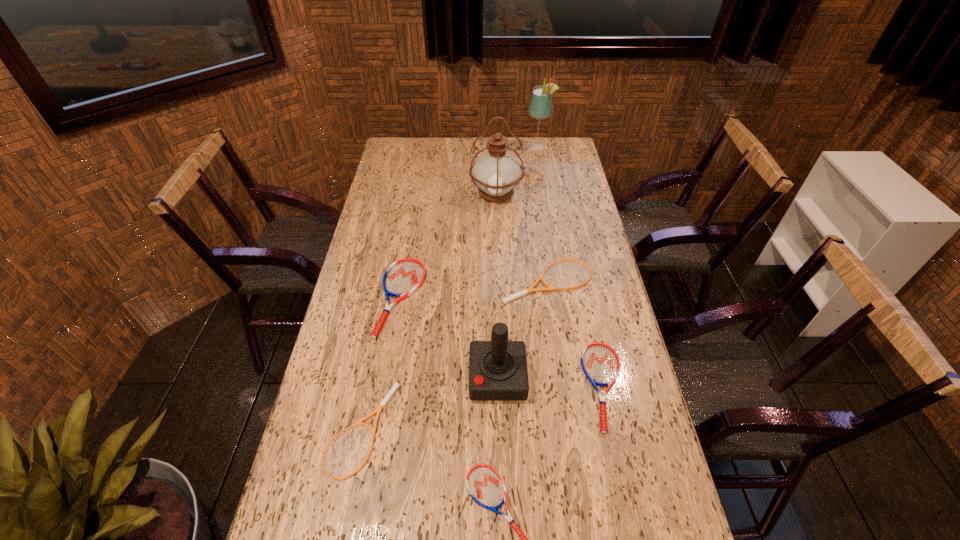
Image resolution: width=960 pixels, height=540 pixels. Find the location of `the smaller beige tennis racket`. the smaller beige tennis racket is located at coordinates (396, 385).

Where is `the left beige tennis racket`? This screenshot has height=540, width=960. the left beige tennis racket is located at coordinates (396, 385).

Where is `vacant point located 0.160m on the front of the alcohol`? This screenshot has width=960, height=540. vacant point located 0.160m on the front of the alcohol is located at coordinates (542, 171).

Locate an element on the screen. blank space located 0.180m on the right of the seventh nearest object is located at coordinates (565, 193).

I want to click on vacant space located 0.340m on the base of the third tallest object, so click(348, 377).

You are a GUI agent. You are given a task and a screenshot of the screen. Output one action in this format:
    pyautogui.click(x=<x>, y=<y>)
    Task: Click on the vacant area situated on the base of the third tallest object
    The width and height of the screenshot is (960, 540).
    Given the screenshot: What is the action you would take?
    pyautogui.click(x=441, y=377)

Image resolution: width=960 pixels, height=540 pixels. Identify the location of vacant space located on the base of the third tallest object. (366, 377).

Locate an element on the screen. The width and height of the screenshot is (960, 540). vacant area situated 0.080m on the left of the biggest blue tennis racket is located at coordinates (354, 298).

Where is `vacant region located 0.300m on the back of the farther beige tennis racket`? Image resolution: width=960 pixels, height=540 pixels. vacant region located 0.300m on the back of the farther beige tennis racket is located at coordinates (538, 206).

The width and height of the screenshot is (960, 540). In order to click on free space located 0.060m on the back of the rightmost blue tennis racket in this screenshot , I will do `click(592, 329)`.